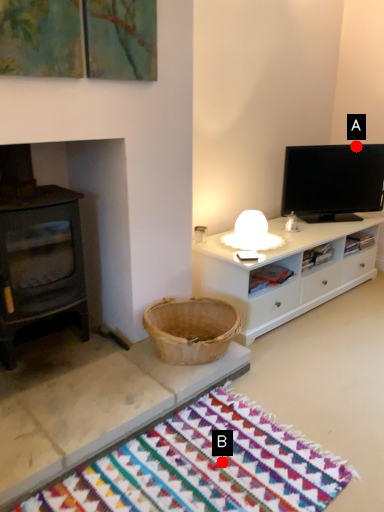
Question: Two points are circled on the image, labeled by A and B beside each circle. Which point is closer to the camera taking this photo?

Choices:
 (A) A is closer
 (B) B is closer

Answer: (B)